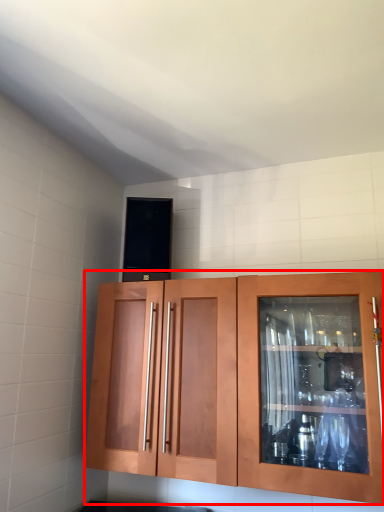
Question: In this image, where is cabinetry (annotated by the red box) located relative to appliance?

Choices:
 (A) left
 (B) right

Answer: (B)